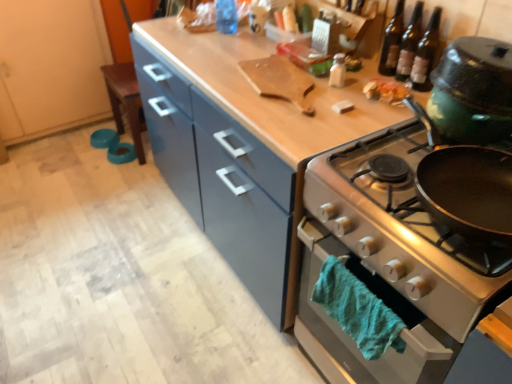
Find the location of a particular element. This screenshot has width=512, height=384. free spot below shiny silver gas stove at right (from a real-world perspective) is located at coordinates (465, 198).